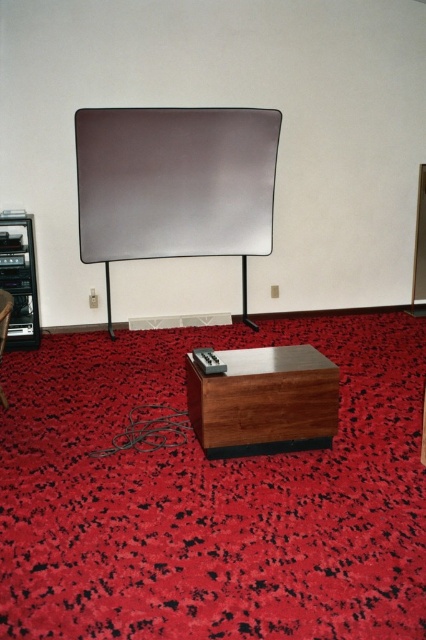
Looking at this image, between matte silver screen at center and metallic black entertainment center at left, which one has more height?

Standing taller between the two is matte silver screen at center.

Locate an element on the screen. matte silver screen at center is located at coordinates (175, 180).

Who is more distant from viewer, (331, 362) or (6, 326)?

Point (6, 326)

Between wooden side table at lower center and matte wood chair at lower left, which one appears on the left side from the viewer's perspective?

matte wood chair at lower left is more to the left.

Locate an element on the screen. wooden side table at lower center is located at coordinates (264, 401).

Can you confirm if wooden side table at lower center is taller than metallic black entertainment center at left?

Incorrect, wooden side table at lower center's height is not larger of metallic black entertainment center at left's.

Based on the photo, which is above, wooden side table at lower center or metallic black entertainment center at left?

metallic black entertainment center at left is higher up.

Does point (229, 449) lie in front of point (14, 253)?

Yes, point (229, 449) is closer to viewer.

The image size is (426, 640). Identify the location of wooden side table at lower center. (264, 401).